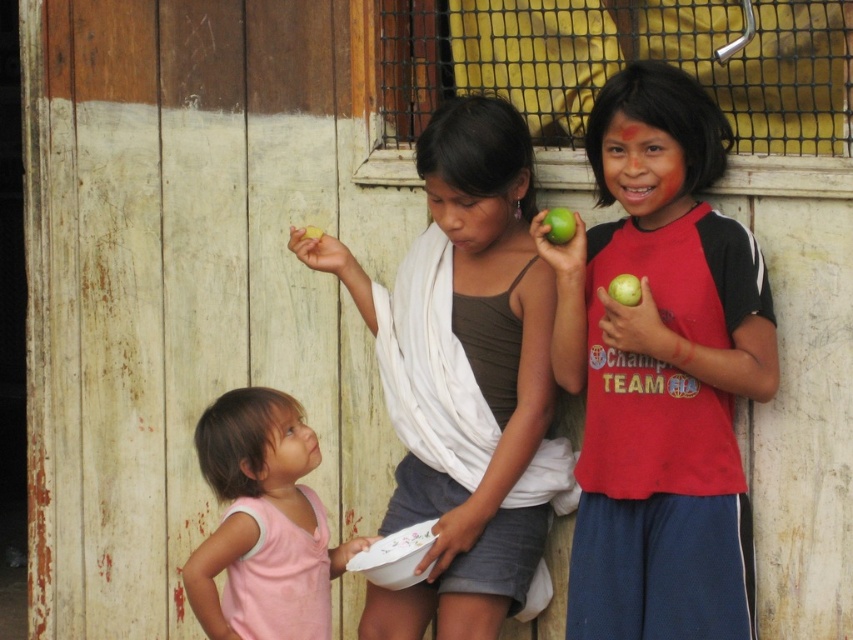
You are standing in front of the children and want to hand a gift to the matte red shirt at center. Based on their position, where should you aim to place the gift so it reaches them?

You should aim to place the gift at the coordinates point (660,371) where the matte red shirt at center is located.

You are taking a photo of two points in the scene. The first point is at coordinate point [561,301] and the second point is at coordinate point [518,388]. Which point will appear larger in your photo?

Point [561,301] is closer to the camera than point [518,388], so it will appear larger in the photo.